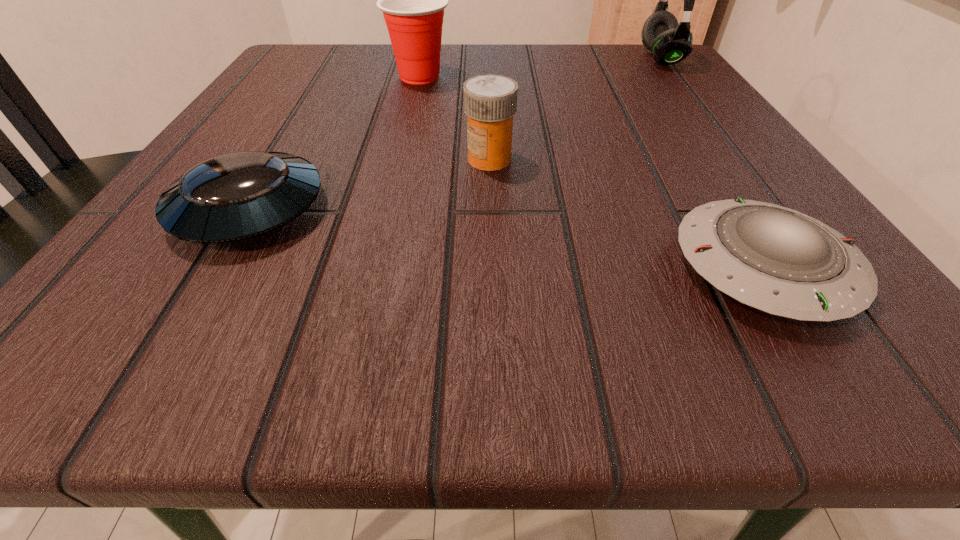
Locate an element on the screen. Image resolution: width=960 pixels, height=540 pixels. headset is located at coordinates (670, 42).

This screenshot has height=540, width=960. In order to click on the second object from left to right in this screenshot , I will do `click(413, 0)`.

This screenshot has height=540, width=960. In order to click on the second tallest object in this screenshot , I will do `click(413, 0)`.

What are the coordinates of `medicine` in the screenshot? It's located at (490, 101).

Find the location of a particular element. This screenshot has height=540, width=960. the third shortest object is located at coordinates (490, 101).

Find the location of a particular element. This screenshot has height=540, width=960. the fourth tallest object is located at coordinates (235, 196).

Image resolution: width=960 pixels, height=540 pixels. Identify the location of the leftmost object. (235, 196).

Where is `the shortest object`? The image size is (960, 540). the shortest object is located at coordinates (777, 260).

Locate an element on the screen. Image resolution: width=960 pixels, height=540 pixels. the right saucer is located at coordinates (777, 260).

Where is `vacant space located 0.340m on the ear cups of the tallest object`? The width and height of the screenshot is (960, 540). vacant space located 0.340m on the ear cups of the tallest object is located at coordinates (465, 58).